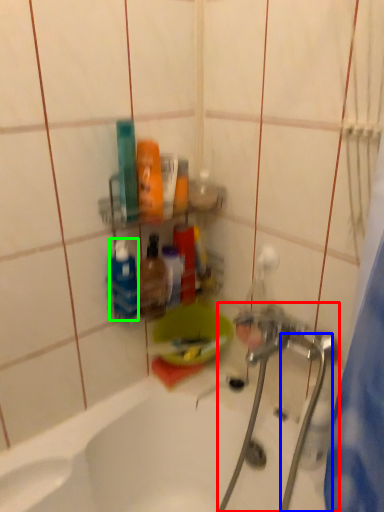
Question: Which object is positioned farthest from plumbing fixture (highlighted by a red box)? Select from water pipe (highlighted by a blue box) and toiletry (highlighted by a green box).

Choices:
 (A) water pipe
 (B) toiletry

Answer: (B)